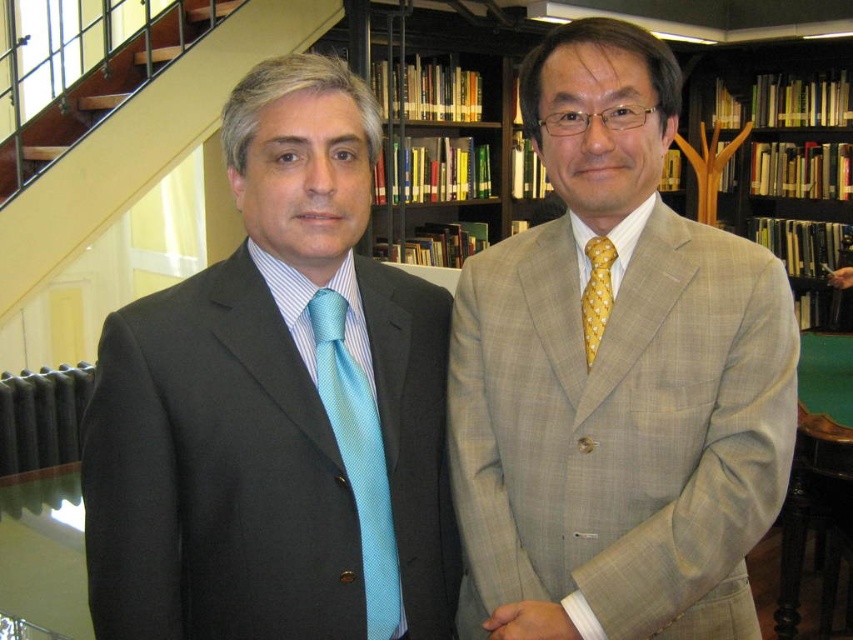
Is light beige textured suit at right taller than light blue textured tie at left?

Indeed, light beige textured suit at right has a greater height compared to light blue textured tie at left.

Who is more distant from viewer, (573, 605) or (387, 547)?

The point (387, 547) is behind.

Does point (537, 401) come behind point (370, 413)?

That is True.

Where is `light beige textured suit at right`? This screenshot has width=853, height=640. light beige textured suit at right is located at coordinates (614, 380).

Is light beige textured suit at right smaller than yellow dotted tie at right?

No, light beige textured suit at right is not smaller than yellow dotted tie at right.

Is light beige textured suit at right positioned in front of yellow dotted tie at right?

Yes.

Locate an element on the screen. Image resolution: width=853 pixels, height=640 pixels. light beige textured suit at right is located at coordinates (614, 380).

This screenshot has width=853, height=640. I want to click on light beige textured suit at right, so click(x=614, y=380).

Does light beige textured suit at right have a lesser width compared to wooden stairs at upper left?

Correct, light beige textured suit at right's width is less than wooden stairs at upper left's.

Measure the distance from light beige textured suit at right to wooden stairs at upper left.

light beige textured suit at right is 6.72 feet from wooden stairs at upper left.

Is point (621, 260) less distant than point (166, 17)?

Yes, it is in front of point (166, 17).

The image size is (853, 640). I want to click on light beige textured suit at right, so click(614, 380).